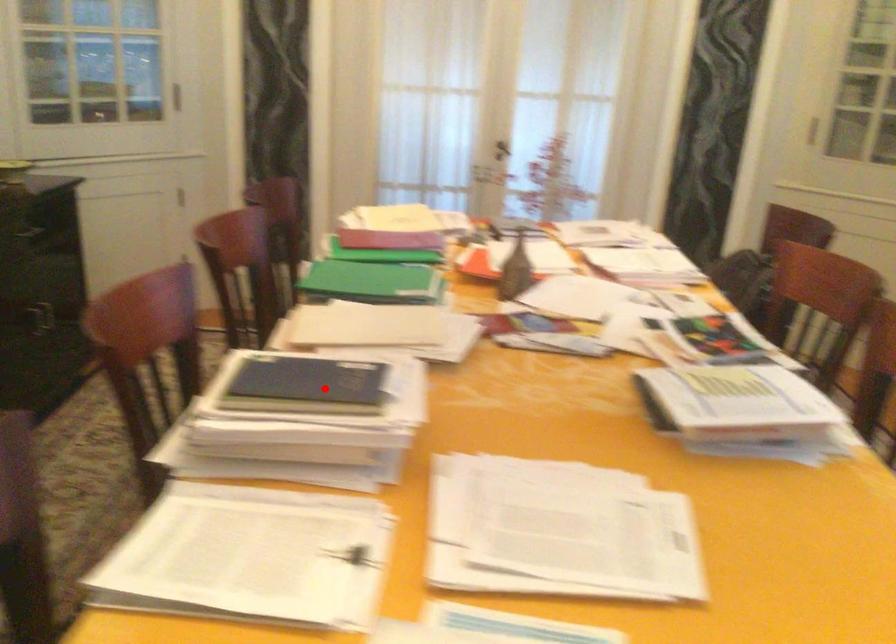
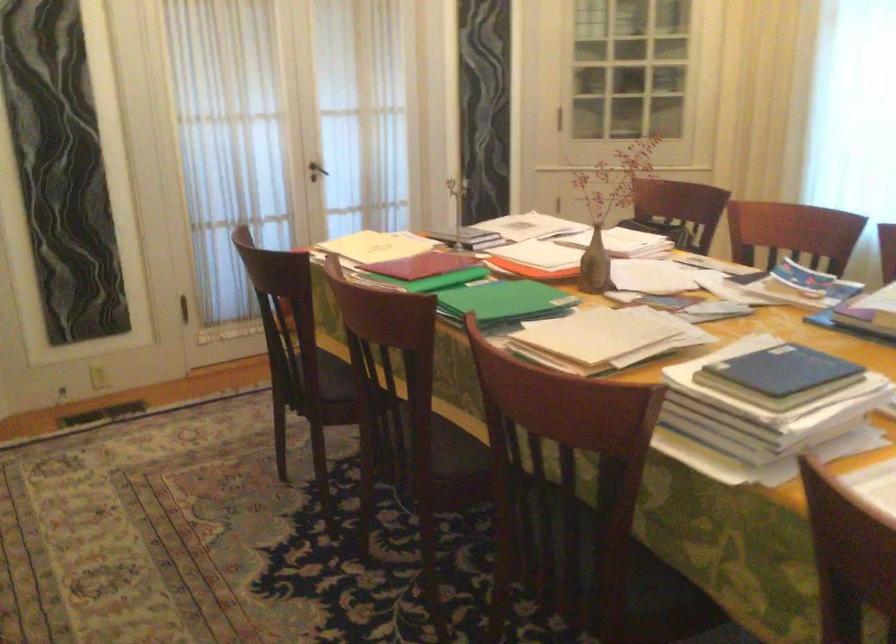
In the second image, find the point that corresponds to the highlighted location in the first image.

(782, 370)